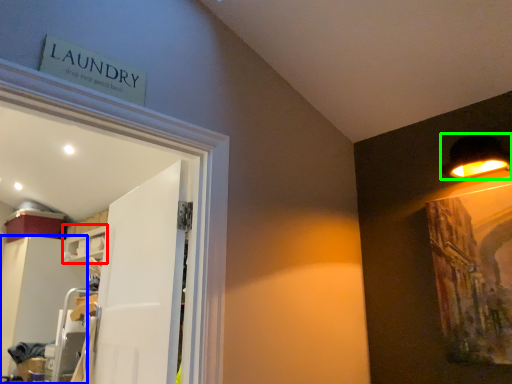
Question: Considering the real-world distances, which object is farthest from shelf (highlighted by a red box)? cabinetry (highlighted by a blue box) or lamp (highlighted by a green box)?

Choices:
 (A) cabinetry
 (B) lamp

Answer: (B)